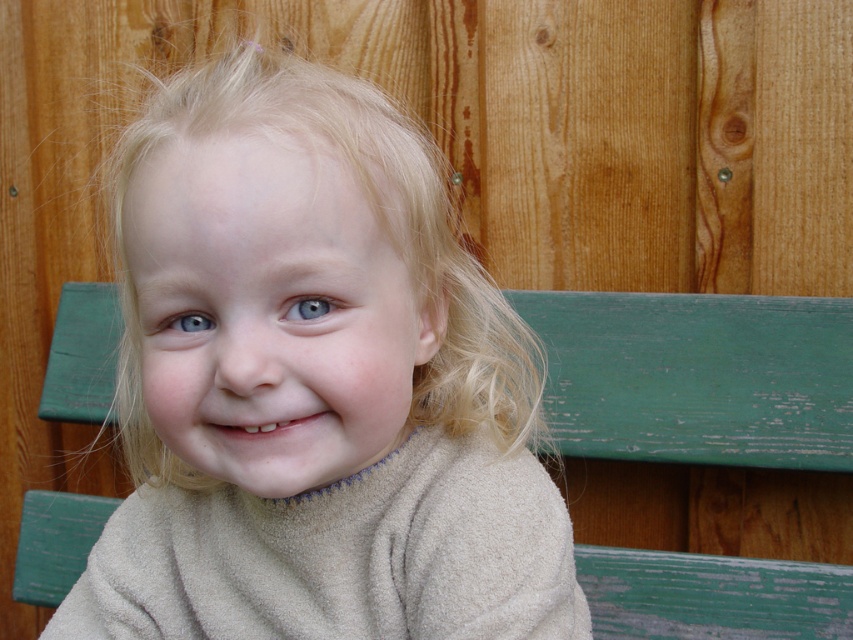
Question: Which point is closer to the camera?

Choices:
 (A) (585, 554)
 (B) (331, 592)

Answer: (B)

Question: Can you confirm if beige fleece at center is positioned above green painted wood bench at center?

Choices:
 (A) yes
 (B) no

Answer: (A)

Question: From the image, what is the correct spatial relationship of beige fleece at center in relation to green painted wood bench at center?

Choices:
 (A) below
 (B) above

Answer: (B)

Question: Does beige fleece at center appear on the left side of green painted wood bench at center?

Choices:
 (A) yes
 (B) no

Answer: (A)

Question: Which object appears farthest from the camera in this image?

Choices:
 (A) beige fleece at center
 (B) green painted wood bench at center

Answer: (B)